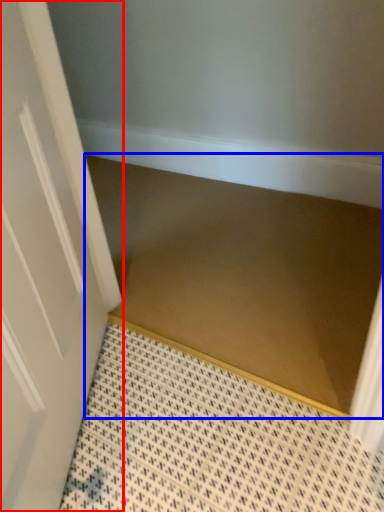
Question: Which point is closer to the camera, door (highlighted by a red box) or stair (highlighted by a blue box)?

Choices:
 (A) door
 (B) stair

Answer: (A)